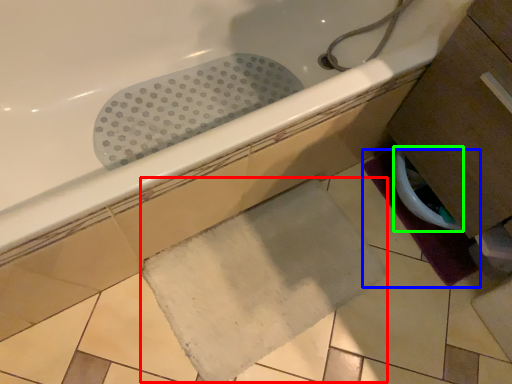
Question: Which object is the farthest from bath mat (highlighted by a red box)? Choose among these: bath mat (highlighted by a blue box) or toilet bowl (highlighted by a green box).

Choices:
 (A) bath mat
 (B) toilet bowl

Answer: (B)